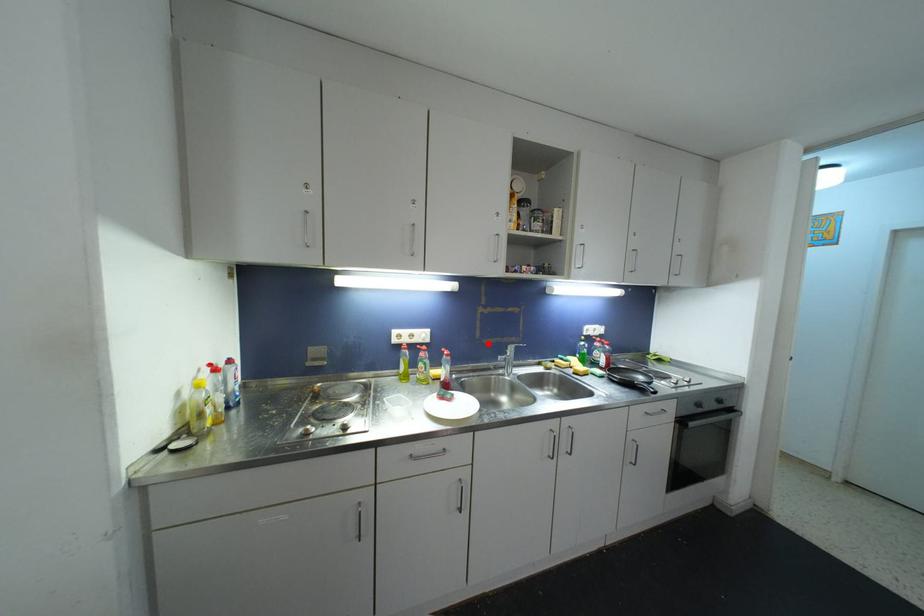
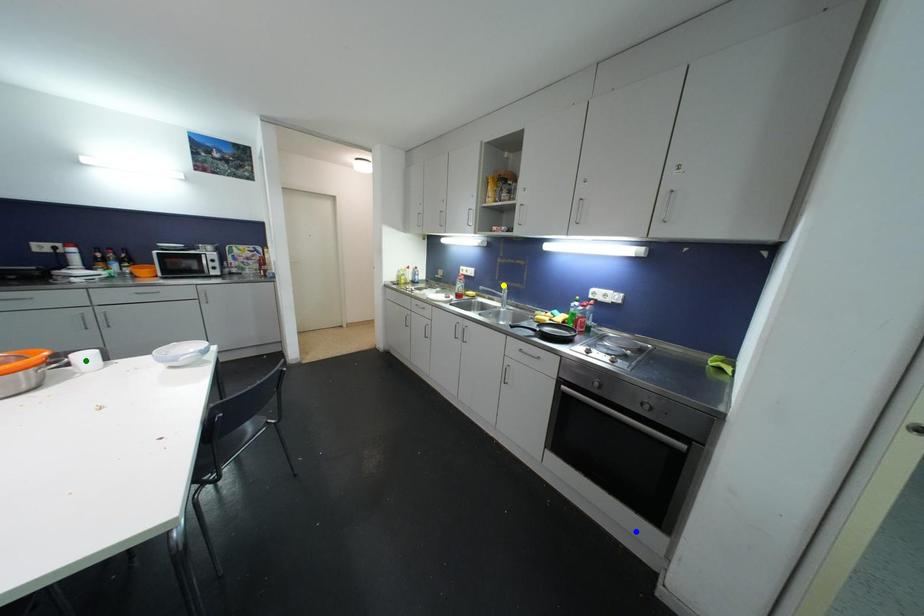
Question: I am providing you with two images of the same scene from different viewpoints. A red point is marked on the first image. You are given multiple points on the second image. Which point in image 2 is actually the same real-world point as the red point in image 1?

Choices:
 (A) green point
 (B) yellow point
 (C) blue point

Answer: (B)